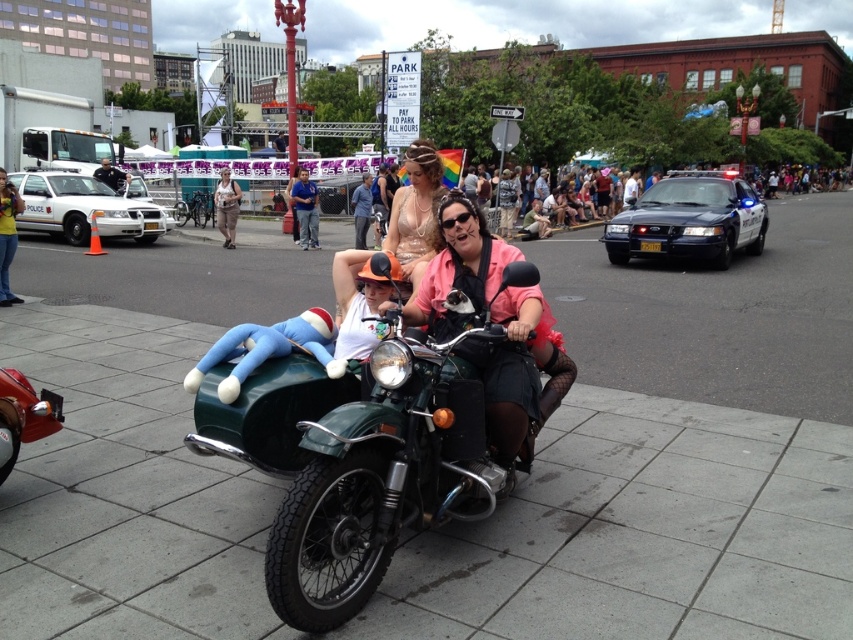
Which of these two, pink satin dress at center or matte beige dress at center, stands taller?

With more height is matte beige dress at center.

Consider the image. Can you confirm if pink satin dress at center is positioned above matte beige dress at center?

Incorrect, pink satin dress at center is not positioned above matte beige dress at center.

Is point (549, 380) farther from viewer compared to point (233, 218)?

No, (549, 380) is closer to viewer.

What are the coordinates of `pink satin dress at center` in the screenshot? It's located at (497, 323).

Which is in front, point (399, 237) or point (112, 180)?

Point (399, 237) is in front.

Does point (410, 193) lie in front of point (109, 180)?

Yes.

Which is in front, point (415, 208) or point (128, 177)?

Point (415, 208) is more forward.

At what (x,y) coordinates should I click in order to perform the action: click on shiny gold dress at center. Please return your answer as a coordinate pair (x, y). Looking at the image, I should click on (415, 212).

Does green matte motorcycle at center have a larger size compared to pink satin dress at center?

Yes.

Is green matte motorcycle at center thinner than pink satin dress at center?

No, green matte motorcycle at center is not thinner than pink satin dress at center.

What do you see at coordinates (387, 468) in the screenshot? I see `green matte motorcycle at center` at bounding box center [387, 468].

Locate an element on the screen. green matte motorcycle at center is located at coordinates (387, 468).